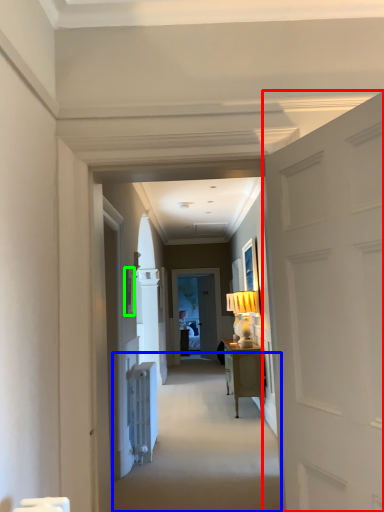
Question: Considering the real-world distances, which object is farthest from door (highlighted by a red box)? path (highlighted by a blue box) or picture frame (highlighted by a green box)?

Choices:
 (A) path
 (B) picture frame

Answer: (B)